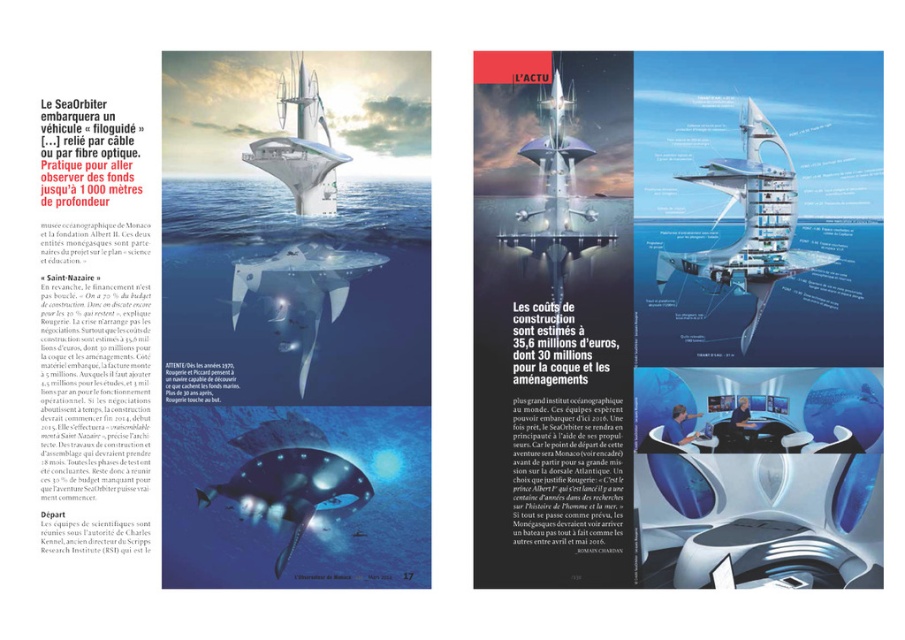
Based on the coordinates provided, what object is located at point (294, 320) in the image?

The point (294, 320) indicates the white glossy submarine at center.

You are an oceanographer planning to observe marine life from the SeaOrbiter. You have access to both the translucent glass pod at center and the shiny silver submarine at center. Which one allows you to get a closer view of the marine life without descending deeper into the water?

The translucent glass pod at center is closer to the viewer than the shiny silver submarine at center, so it allows you to observe marine life from a closer vantage point without going deeper into the water.